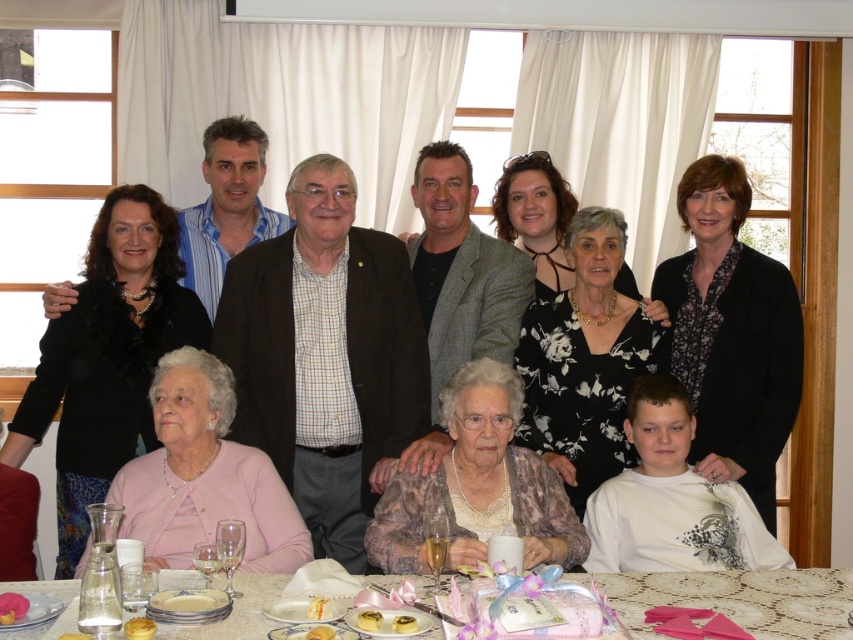
Question: Which of the following is the closest to the observer?

Choices:
 (A) coord(567,579)
 (B) coord(312,637)

Answer: (B)

Question: Which of the following is the closest to the observer?

Choices:
 (A) (308, 604)
 (B) (36, 586)
 (C) (143, 628)
 (D) (412, 632)

Answer: (C)

Question: Which point appears farthest from the camera in this image?

Choices:
 (A) (357, 618)
 (B) (6, 611)

Answer: (A)

Question: Is golden buttery croissant at lower center above clear plastic cup at lower left?

Choices:
 (A) no
 (B) yes

Answer: (A)

Question: Observing the image, what is the correct spatial positioning of golden buttery croissant at lower center in reference to clear plastic cup at lower left?

Choices:
 (A) below
 (B) above

Answer: (A)

Question: Is golden buttery croissant at lower center closer to camera compared to smooth yellow cake at lower center?

Choices:
 (A) yes
 (B) no

Answer: (B)